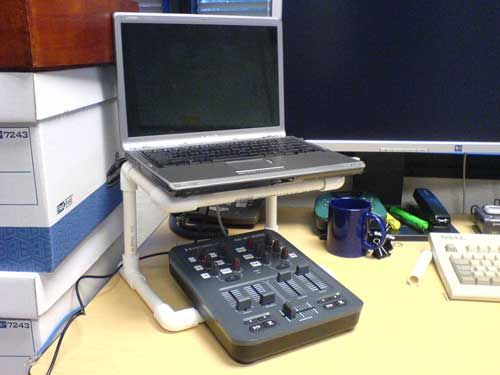
Find the location of a particular element. coffee mug is located at coordinates (343, 223).